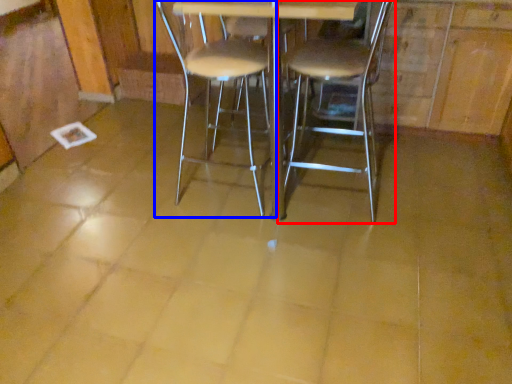
Question: Which point is further to the camera, chair (highlighted by a red box) or chair (highlighted by a blue box)?

Choices:
 (A) chair
 (B) chair

Answer: (B)